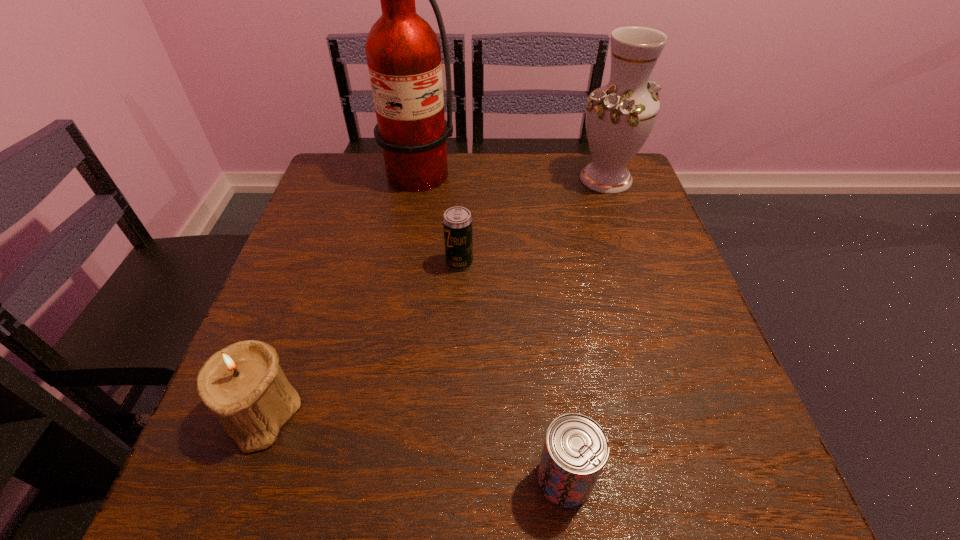
Find the location of a particular element. The width and height of the screenshot is (960, 540). vacant space situated on the back of the candle_holder is located at coordinates (324, 244).

Where is `free location located on the front of the third farthest object`? free location located on the front of the third farthest object is located at coordinates (456, 330).

Where is `free point located on the back of the fourth object from left to right`? free point located on the back of the fourth object from left to right is located at coordinates (540, 281).

What are the coordinates of `fire extinguisher that is at the far edge` in the screenshot? It's located at pos(403,53).

This screenshot has height=540, width=960. Identify the location of vase that is at the far edge. (620, 116).

Locate an element on the screen. candle_holder that is at the near edge is located at coordinates (242, 383).

Where is `beer can positioned at the near edge`? beer can positioned at the near edge is located at coordinates (576, 448).

Image resolution: width=960 pixels, height=540 pixels. Find the location of `fire extinguisher that is at the left edge`. fire extinguisher that is at the left edge is located at coordinates (403, 53).

Locate an element on the screen. This screenshot has height=540, width=960. candle_holder that is at the left edge is located at coordinates (242, 383).

At what (x,y) coordinates should I click in order to perform the action: click on object that is positioned at the right edge. Please return your answer as a coordinate pair (x, y). Image resolution: width=960 pixels, height=540 pixels. Looking at the image, I should click on (620, 116).